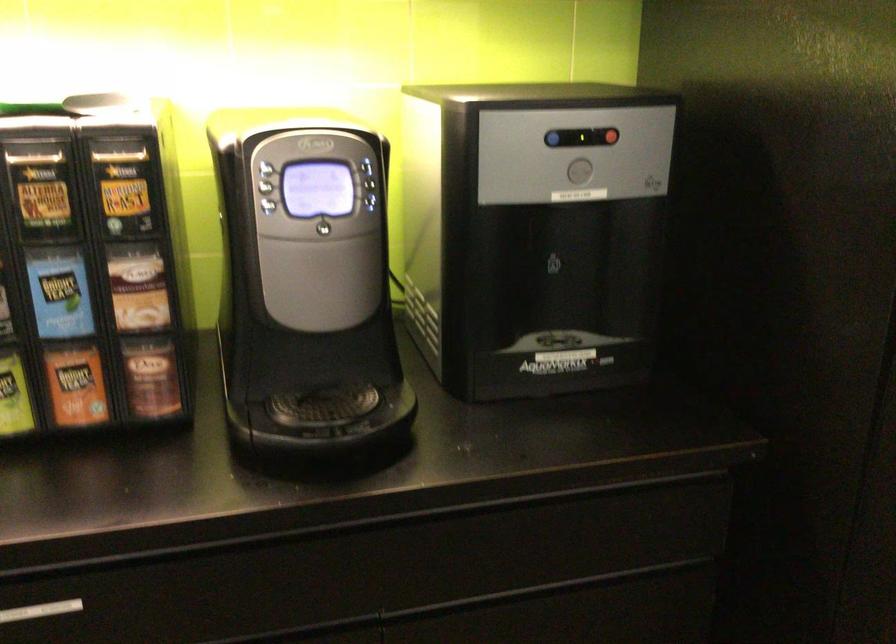
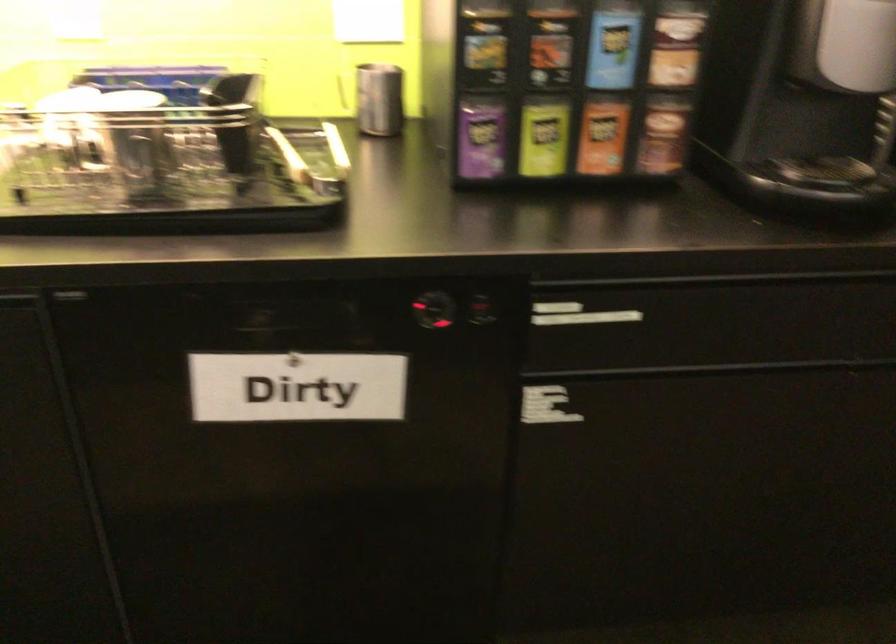
Question: The images are taken continuously from a first-person perspective. In which direction are you moving?

Choices:
 (A) Left
 (B) Right
 (C) Forward
 (D) Backward

Answer: (A)